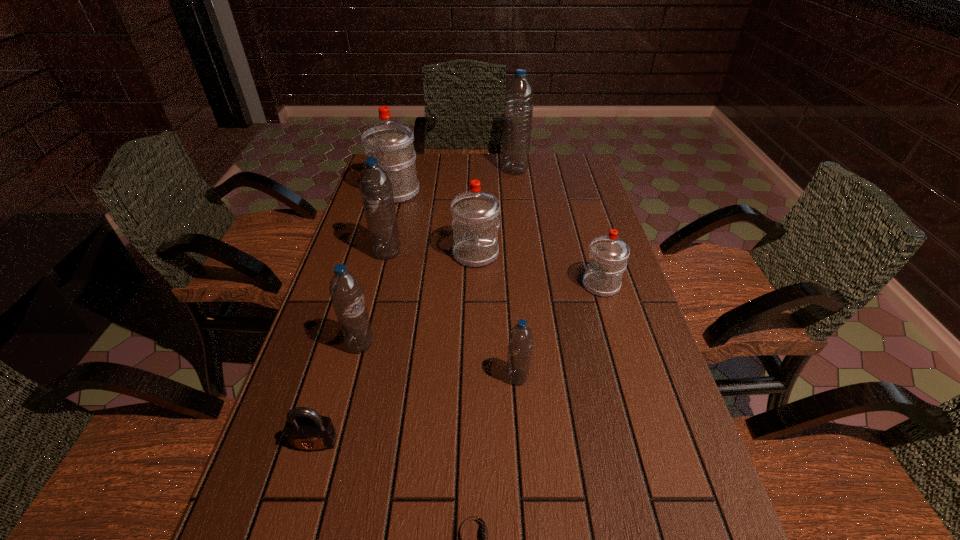
Where is `vacant point located between the biggest white water bottle and the nearest water bottle`? vacant point located between the biggest white water bottle and the nearest water bottle is located at coordinates (457, 285).

At what (x,y) coordinates should I click in order to perform the action: click on unoccupied area between the nearest water bottle and the second nearest blue water bottle. Please return your answer as a coordinate pair (x, y). Looking at the image, I should click on (439, 361).

Where is `vacant area that lies between the second nearest water bottle and the third nearest blue water bottle`? This screenshot has width=960, height=540. vacant area that lies between the second nearest water bottle and the third nearest blue water bottle is located at coordinates (373, 299).

Locate an element on the screen. The image size is (960, 540). free space between the smallest blue water bottle and the third biggest blue water bottle is located at coordinates (439, 361).

Find the location of a particular element. This screenshot has height=540, width=960. empty space between the sixth farthest object and the farthest blue water bottle is located at coordinates 438,258.

I want to click on free space between the fourth nearest object and the second farthest blue water bottle, so click(x=373, y=299).

Where is `blank region between the sixth farthest object and the tallest object`? This screenshot has width=960, height=540. blank region between the sixth farthest object and the tallest object is located at coordinates (438, 258).

Where is `free spot between the second nearest water bottle and the rightmost white water bottle`? The width and height of the screenshot is (960, 540). free spot between the second nearest water bottle and the rightmost white water bottle is located at coordinates (481, 315).

Identify which object is located as the nearest to the farthest water bottle. Please provide its 2D coordinates. Your answer should be formatted as a tuple, i.e. [(x, y)], where the tuple contains the x and y coordinates of a point satisfying the conditions above.

[(392, 142)]

What are the coordinates of `the eighth closest object to the second white water bottle from left to right` in the screenshot? It's located at (473, 536).